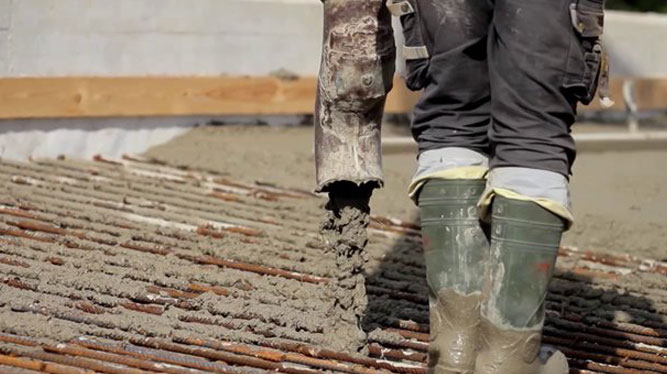
Where is `wood plank`? wood plank is located at coordinates (173, 88), (400, 94), (616, 88), (656, 91).